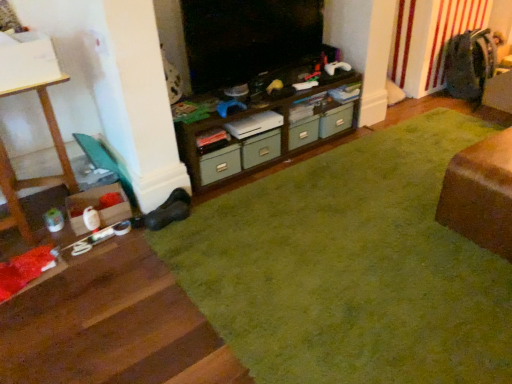
Find the location of a particular element. The image size is (512, 384). free space in front of green matte drawer at center, placed as the 1th drawer when sorted from right to left is located at coordinates (344, 148).